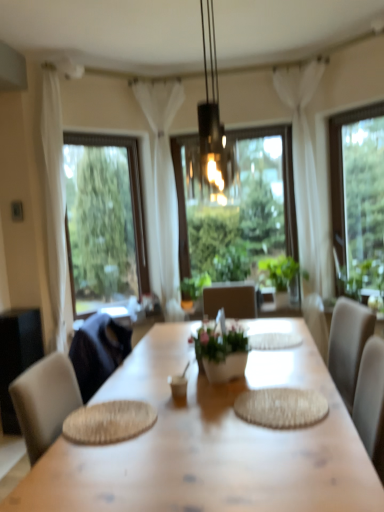
Question: From a real-world perspective, is clear glass window at left, which ranks as the 1th window in left-to-right order, positioned above or below green leafy plant at right?

Choices:
 (A) above
 (B) below

Answer: (A)

Question: Considering their positions, is clear glass window at left, arranged as the third window when viewed from the right, located in front of or behind green leafy plant at right?

Choices:
 (A) behind
 (B) front

Answer: (A)

Question: Which of these objects is positioned farthest from the green leafy plant at center, which is the second houseplant in left-to-right order?

Choices:
 (A) black glass pendant light at center
 (B) clear glass window at left, which ranks as the 1th window in left-to-right order
 (C) green matte plant at center, the 2th houseplant positioned from the right
 (D) green leafy plant at right
 (E) white sheer curtain at upper right, the 1th curtain when ordered from right to left

Answer: (C)

Question: Which is nearer to the transparent glass window at center, the second window when ordered from left to right?

Choices:
 (A) green leafy plant at right
 (B) clear glass window at left, which ranks as the 1th window in left-to-right order
 (C) black glass pendant light at center
 (D) white sheer curtain at center, which is counted as the 2th curtain, starting from the right
 (E) woven beige placemat at center

Answer: (D)